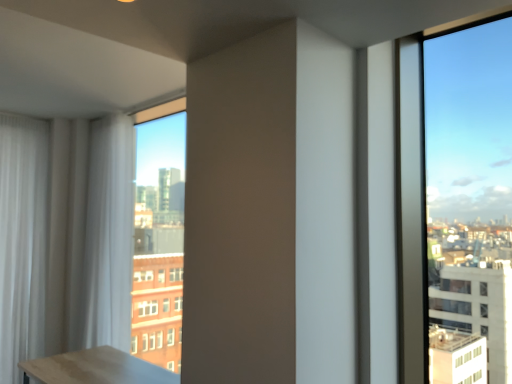
Question: Considering the relative sizes of white sheer curtain at left, acting as the 2th curtain starting from the right, and white sheer curtain at left, which is counted as the first curtain, starting from the right, in the image provided, is white sheer curtain at left, acting as the 2th curtain starting from the right, thinner than white sheer curtain at left, which is counted as the first curtain, starting from the right,?

Choices:
 (A) no
 (B) yes

Answer: (B)

Question: Is white sheer curtain at left, acting as the 2th curtain starting from the right, not close to white sheer curtain at left, which is counted as the first curtain, starting from the right?

Choices:
 (A) no
 (B) yes

Answer: (A)

Question: From the image's perspective, would you say white sheer curtain at left, acting as the 2th curtain starting from the right, is positioned over white sheer curtain at left, which is the second curtain from left to right?

Choices:
 (A) yes
 (B) no

Answer: (B)

Question: From a real-world perspective, does white sheer curtain at left, acting as the 2th curtain starting from the right, sit lower than white sheer curtain at left, which is counted as the first curtain, starting from the right?

Choices:
 (A) yes
 (B) no

Answer: (A)

Question: Considering the relative sizes of white sheer curtain at left, acting as the 2th curtain starting from the right, and white sheer curtain at left, which is the second curtain from left to right, in the image provided, is white sheer curtain at left, acting as the 2th curtain starting from the right, smaller than white sheer curtain at left, which is the second curtain from left to right,?

Choices:
 (A) no
 (B) yes

Answer: (B)

Question: Is white sheer curtain at left, marked as the 1th curtain in a left-to-right arrangement, to the left of white sheer curtain at left, which is the second curtain from left to right, from the viewer's perspective?

Choices:
 (A) yes
 (B) no

Answer: (A)

Question: Is white sheer curtain at left, which is counted as the first curtain, starting from the right, surrounding white sheer curtain at left, marked as the 1th curtain in a left-to-right arrangement?

Choices:
 (A) no
 (B) yes

Answer: (A)

Question: Is white sheer curtain at left, which is counted as the first curtain, starting from the right, positioned behind white sheer curtain at left, marked as the 1th curtain in a left-to-right arrangement?

Choices:
 (A) yes
 (B) no

Answer: (B)

Question: Is white sheer curtain at left, which is the second curtain from left to right, closer to the viewer compared to white sheer curtain at left, acting as the 2th curtain starting from the right?

Choices:
 (A) no
 (B) yes

Answer: (B)

Question: Is white sheer curtain at left, which is counted as the first curtain, starting from the right, at the left side of white sheer curtain at left, marked as the 1th curtain in a left-to-right arrangement?

Choices:
 (A) no
 (B) yes

Answer: (A)

Question: From a real-world perspective, does white sheer curtain at left, which is counted as the first curtain, starting from the right, stand above white sheer curtain at left, marked as the 1th curtain in a left-to-right arrangement?

Choices:
 (A) no
 (B) yes

Answer: (B)

Question: Considering the relative sizes of white sheer curtain at left, which is the second curtain from left to right, and white sheer curtain at left, marked as the 1th curtain in a left-to-right arrangement, in the image provided, is white sheer curtain at left, which is the second curtain from left to right, shorter than white sheer curtain at left, marked as the 1th curtain in a left-to-right arrangement,?

Choices:
 (A) yes
 (B) no

Answer: (A)

Question: Is white sheer curtain at left, which is the second curtain from left to right, in front of or behind white sheer curtain at left, acting as the 2th curtain starting from the right, in the image?

Choices:
 (A) behind
 (B) front

Answer: (B)